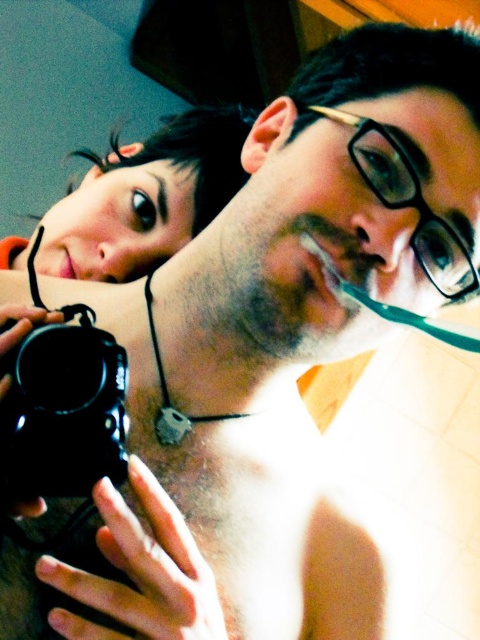
Question: Is matte black hair at upper left bigger than pink matte lips at upper left?

Choices:
 (A) yes
 (B) no

Answer: (A)

Question: Does black plastic camera at lower left appear under pink matte lips at upper left?

Choices:
 (A) no
 (B) yes

Answer: (B)

Question: Which of these objects is positioned closest to the matte black hair at upper left?

Choices:
 (A) pink matte lips at upper left
 (B) black plastic camera at lower left

Answer: (A)

Question: Is matte black hair at upper left closer to camera compared to pink matte lips at upper left?

Choices:
 (A) yes
 (B) no

Answer: (A)

Question: Which of these objects is positioned closest to the black plastic camera at lower left?

Choices:
 (A) matte black hair at upper left
 (B) pink matte lips at upper left

Answer: (B)

Question: Which point appears farthest from the camera in this image?

Choices:
 (A) (73, 424)
 (B) (61, 244)

Answer: (B)